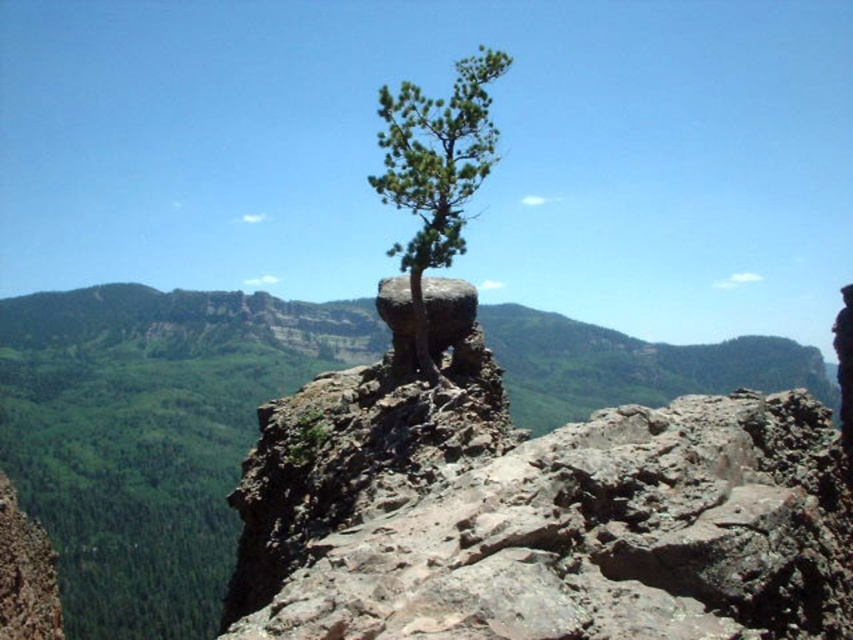
Is green rough textured tree at center taller than rusty rock at center?

Yes, green rough textured tree at center is taller than rusty rock at center.

Between green rough textured tree at center and rusty rock at center, which one has more height?

Standing taller between the two is green rough textured tree at center.

Identify the location of green rough textured tree at center. The image size is (853, 640). (434, 182).